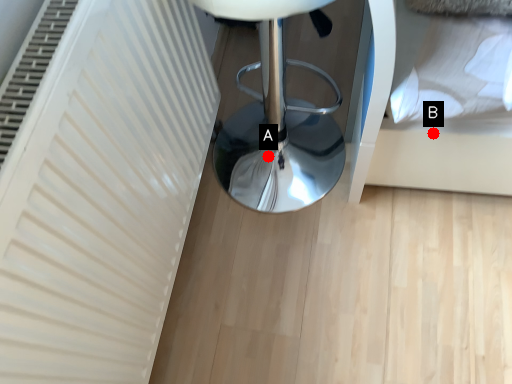
Question: Two points are circled on the image, labeled by A and B beside each circle. Which point is farther to the camera?

Choices:
 (A) A is further
 (B) B is further

Answer: (A)